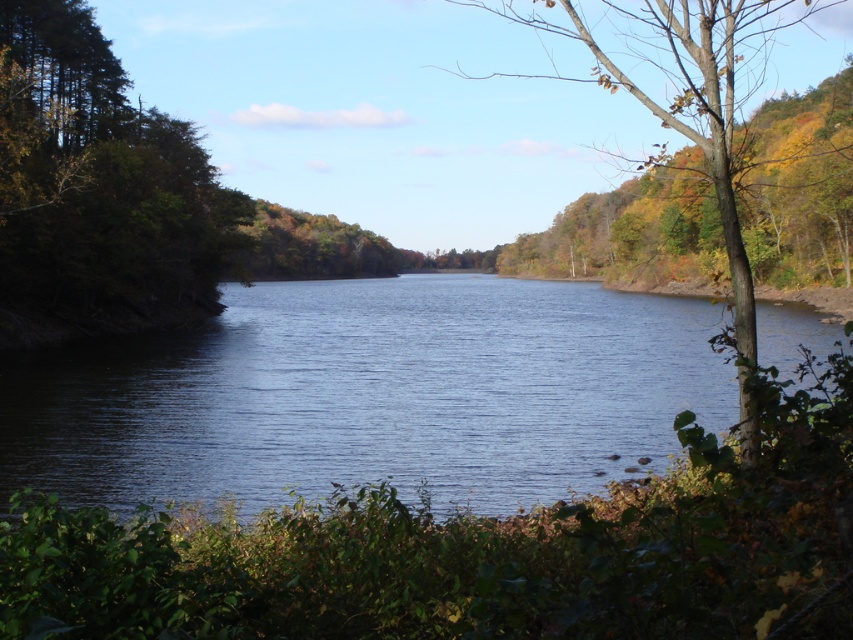
Question: Which point appears closest to the camera in this image?

Choices:
 (A) (61, 413)
 (B) (33, 92)

Answer: (A)

Question: Is blue water at center smaller than brown leafy tree at right?

Choices:
 (A) yes
 (B) no

Answer: (A)

Question: Is blue water at center closer to camera compared to green matte tree at left?

Choices:
 (A) yes
 (B) no

Answer: (A)

Question: Can you confirm if green matte tree at left is positioned to the left of brown leafy tree at right?

Choices:
 (A) yes
 (B) no

Answer: (A)

Question: Among these objects, which one is farthest from the camera?

Choices:
 (A) brown leafy tree at right
 (B) green matte tree at left
 (C) blue water at center

Answer: (B)

Question: Which point is farther from the camera taking this photo?

Choices:
 (A) (387, 445)
 (B) (694, 138)

Answer: (A)